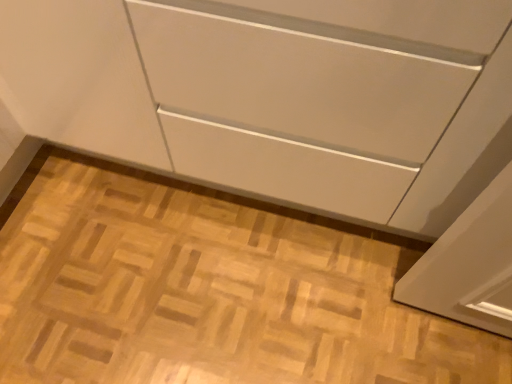
The width and height of the screenshot is (512, 384). In order to click on matte white cabinet at center in this screenshot , I will do `click(208, 289)`.

Measure the distance between point (x=181, y=293) and camera.

A distance of 3.92 feet exists between point (x=181, y=293) and camera.

The width and height of the screenshot is (512, 384). What do you see at coordinates (208, 289) in the screenshot?
I see `matte white cabinet at center` at bounding box center [208, 289].

The width and height of the screenshot is (512, 384). Describe the element at coordinates (277, 96) in the screenshot. I see `white glossy cabinet at center` at that location.

You are a GUI agent. You are given a task and a screenshot of the screen. Output one action in this format:
    pyautogui.click(x=<x>, y=<y>)
    Task: Click on the white glossy cabinet at center
    This screenshot has height=384, width=512.
    Given the screenshot: What is the action you would take?
    pyautogui.click(x=277, y=96)

What is the approximate width of white glossy cabinet at center?

The width of white glossy cabinet at center is 24.08 inches.

The image size is (512, 384). I want to click on matte white cabinet at center, so click(208, 289).

Which is more to the left, matte white cabinet at center or white glossy cabinet at center?

Positioned to the left is white glossy cabinet at center.

Which object is closer to the camera taking this photo, matte white cabinet at center or white glossy cabinet at center?

white glossy cabinet at center is in front.

Which is closer, (280,328) or (277,147)?

Point (277,147)

From the image's perspective, relative to white glossy cabinet at center, is matte white cabinet at center above or below?

Based on their image positions, matte white cabinet at center is located beneath white glossy cabinet at center.

Based on the photo, from a real-world perspective, is matte white cabinet at center positioned over white glossy cabinet at center based on gravity?

No, from a real-world perspective, matte white cabinet at center is not over white glossy cabinet at center

In terms of width, does matte white cabinet at center look wider or thinner when compared to white glossy cabinet at center?

In the image, matte white cabinet at center appears to be wider than white glossy cabinet at center.

Who is shorter, matte white cabinet at center or white glossy cabinet at center?

matte white cabinet at center is shorter.

Can you confirm if matte white cabinet at center is bigger than white glossy cabinet at center?

No.

Is matte white cabinet at center completely or partially outside of white glossy cabinet at center?

That's correct, matte white cabinet at center is outside of white glossy cabinet at center.

Is matte white cabinet at center in contact with white glossy cabinet at center?

No, matte white cabinet at center is not making contact with white glossy cabinet at center.

Is matte white cabinet at center aimed at white glossy cabinet at center?

No, matte white cabinet at center does not turn towards white glossy cabinet at center.

How different are the orientations of matte white cabinet at center and white glossy cabinet at center in degrees?

The angle between the facing direction of matte white cabinet at center and the facing direction of white glossy cabinet at center is 89.5 degrees.

How distant is matte white cabinet at center from white glossy cabinet at center?

matte white cabinet at center is 15.12 inches away from white glossy cabinet at center.

Locate an element on the screen. plain below the white glossy cabinet at center (from a real-world perspective) is located at coordinates (x=208, y=289).

Considering the positions of objects white glossy cabinet at center and matte white cabinet at center in the image provided, who is more to the left, white glossy cabinet at center or matte white cabinet at center?

white glossy cabinet at center.

Which is behind, white glossy cabinet at center or matte white cabinet at center?

Positioned behind is matte white cabinet at center.

Which is less distant, (207, 6) or (134, 230)?

Point (207, 6) appears to be closer to the viewer than point (134, 230).

From the image's perspective, who appears lower, white glossy cabinet at center or matte white cabinet at center?

matte white cabinet at center, from the image's perspective.

From a real-world perspective, between white glossy cabinet at center and matte white cabinet at center, who is vertically lower?

From a 3D spatial view, matte white cabinet at center is below.

Can you confirm if white glossy cabinet at center is wider than matte white cabinet at center?

No, white glossy cabinet at center is not wider than matte white cabinet at center.

Is white glossy cabinet at center shorter than matte white cabinet at center?

No.

Which of these two, white glossy cabinet at center or matte white cabinet at center, is bigger?

white glossy cabinet at center.

Is white glossy cabinet at center situated inside matte white cabinet at center or outside?

white glossy cabinet at center cannot be found inside matte white cabinet at center.

Looking at this image, is white glossy cabinet at center positioned far away from matte white cabinet at center?

That's not correct — white glossy cabinet at center is a little close to matte white cabinet at center.

Is white glossy cabinet at center oriented away from matte white cabinet at center?

That's not correct — white glossy cabinet at center is not looking away from matte white cabinet at center.

Can you tell me how much white glossy cabinet at center and matte white cabinet at center differ in facing direction?

89.5 degrees.

Image resolution: width=512 pixels, height=384 pixels. In order to click on plain beneath the white glossy cabinet at center (from a real-world perspective) in this screenshot , I will do `click(208, 289)`.

Where is `plain below the white glossy cabinet at center (from a real-world perspective)`? plain below the white glossy cabinet at center (from a real-world perspective) is located at coordinates (208, 289).

What are the coordinates of `plain that is on the right side of white glossy cabinet at center` in the screenshot? It's located at (208, 289).